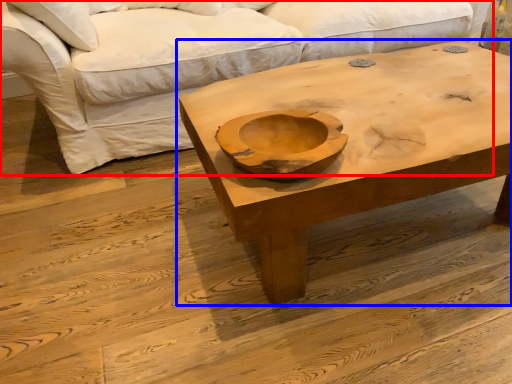
Question: Which object is closer to the camera taking this photo, studio couch (highlighted by a red box) or coffee table (highlighted by a blue box)?

Choices:
 (A) studio couch
 (B) coffee table

Answer: (B)